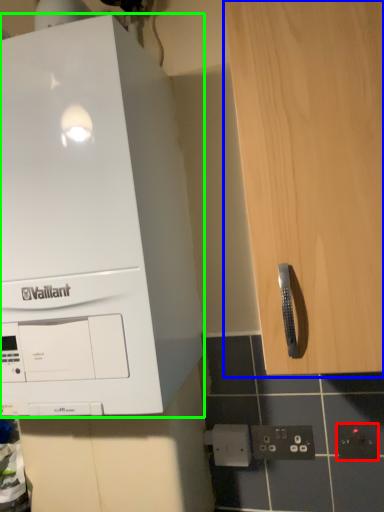
Question: Based on their relative distances, which object is nearer to electric outlet (highlighted by a red box)? Choose from cabinetry (highlighted by a blue box) and home appliance (highlighted by a green box).

Choices:
 (A) cabinetry
 (B) home appliance

Answer: (A)